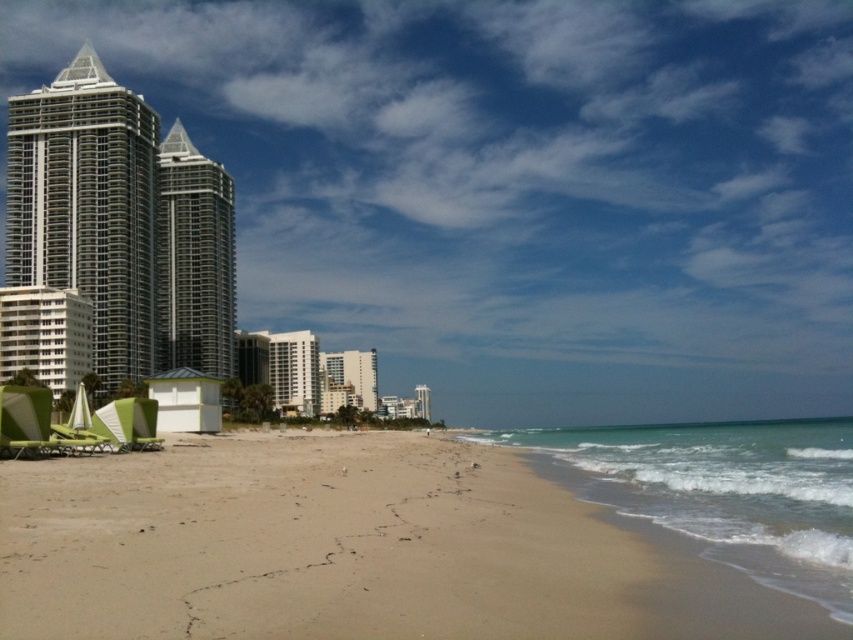
Does silver metallic building at upper left lie behind silver metallic building at center-left?

No, it is not.

Locate an element on the screen. The height and width of the screenshot is (640, 853). silver metallic building at upper left is located at coordinates (86, 205).

Does point (18, 145) lie behind point (221, 314)?

No, (18, 145) is in front of (221, 314).

Where is `silver metallic building at upper left`? silver metallic building at upper left is located at coordinates (86, 205).

Between light brown sand at lower center and white glossy building at center, which one has more height?

white glossy building at center is taller.

Can you confirm if light brown sand at lower center is taller than white glossy building at center?

No, light brown sand at lower center is not taller than white glossy building at center.

Image resolution: width=853 pixels, height=640 pixels. What do you see at coordinates (351, 548) in the screenshot?
I see `light brown sand at lower center` at bounding box center [351, 548].

Identify the location of light brown sand at lower center. (351, 548).

Can you confirm if light brown sand at lower center is positioned above silver metallic building at upper left?

Incorrect, light brown sand at lower center is not positioned above silver metallic building at upper left.

Who is more forward, (508, 600) or (97, 314)?

Point (508, 600) is more forward.

You are a GUI agent. You are given a task and a screenshot of the screen. Output one action in this format:
    pyautogui.click(x=<x>, y=<y>)
    Task: Click on the light brown sand at lower center
    This screenshot has width=853, height=640.
    Given the screenshot: What is the action you would take?
    pyautogui.click(x=351, y=548)